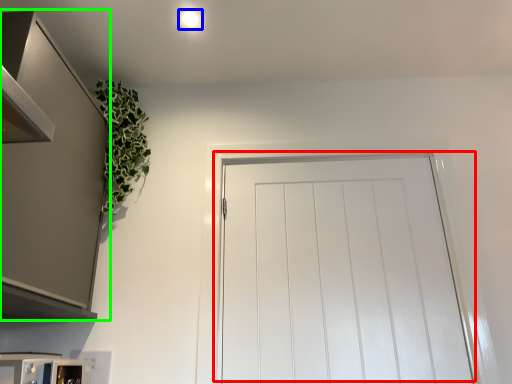
Question: Which object is the farthest from door (highlighted by a red box)? Choose among these: lighting (highlighted by a blue box) or cabinetry (highlighted by a green box).

Choices:
 (A) lighting
 (B) cabinetry

Answer: (A)